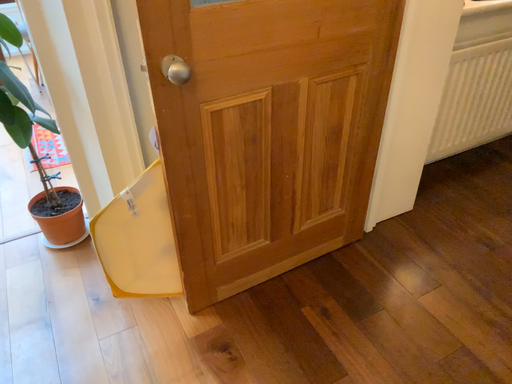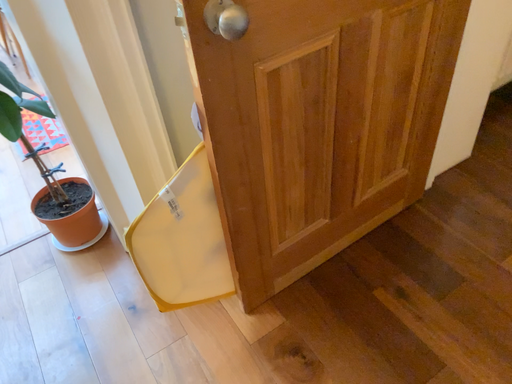
Question: Which way did the camera rotate in the video?

Choices:
 (A) rotated upward
 (B) rotated downward

Answer: (B)